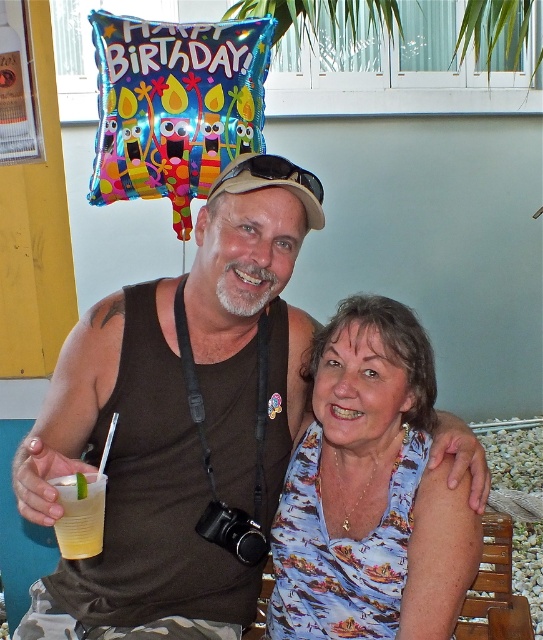
Does printed fabric blouse at center lie in front of yellow translucent cup at lower left?

That is False.

Is printed fabric blouse at center wider than yellow translucent cup at lower left?

Indeed, printed fabric blouse at center has a greater width compared to yellow translucent cup at lower left.

Image resolution: width=543 pixels, height=640 pixels. What are the coordinates of `printed fabric blouse at center` in the screenshot? It's located at (x=369, y=492).

Can you confirm if brown fabric tank top at center is positioned to the left of yellow translucent cup at lower left?

Incorrect, brown fabric tank top at center is not on the left side of yellow translucent cup at lower left.

Is point (206, 372) positioned before point (89, 506)?

No.

What are the coordinates of `brown fabric tank top at center` in the screenshot? It's located at (180, 422).

Is point (104, 595) more distant than point (419, 390)?

No, it is in front of (419, 390).

Which is in front, point (258, 486) or point (374, 296)?

Positioned in front is point (258, 486).

The height and width of the screenshot is (640, 543). I want to click on brown fabric tank top at center, so click(x=180, y=422).